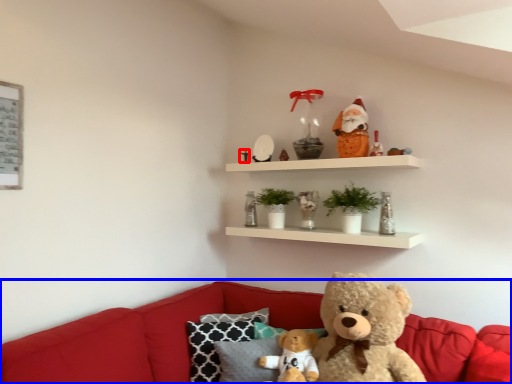
Question: Which point is further to the camera, toy (highlighted by a red box) or studio couch (highlighted by a blue box)?

Choices:
 (A) toy
 (B) studio couch

Answer: (A)